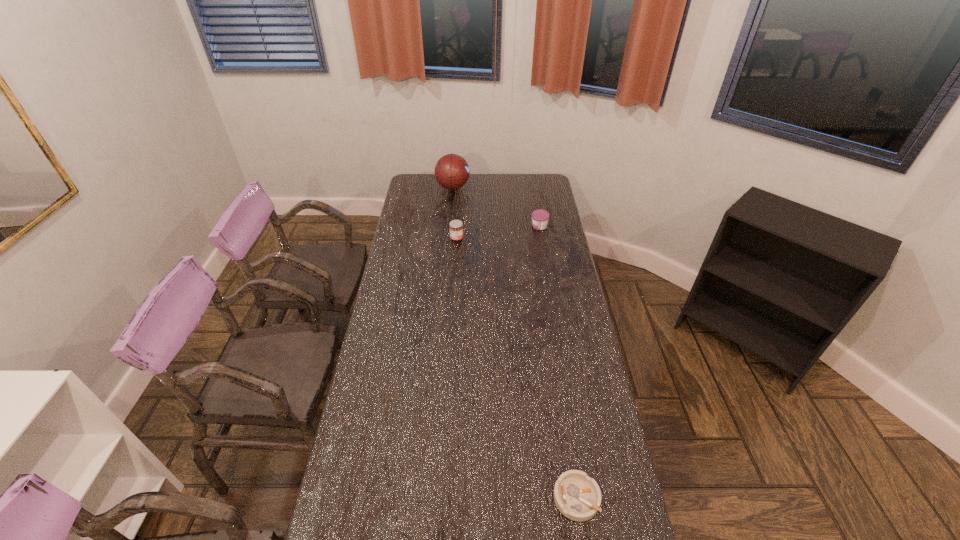
At what (x,y) coordinates should I click in order to perform the action: click on basketball. Please return your answer as a coordinate pair (x, y). Looking at the image, I should click on (452, 171).

The width and height of the screenshot is (960, 540). I want to click on the tallest object, so click(452, 171).

Identify the location of the left jam. (456, 226).

The height and width of the screenshot is (540, 960). In order to click on the third shortest object in this screenshot , I will do `click(456, 226)`.

At what (x,y) coordinates should I click in order to perform the action: click on the shorter jam. Please return your answer as a coordinate pair (x, y). The height and width of the screenshot is (540, 960). Looking at the image, I should click on (540, 217).

Identify the location of the farther jam. (540, 217).

Where is `ashtray`? The height and width of the screenshot is (540, 960). ashtray is located at coordinates tap(577, 496).

Locate an element on the screen. This screenshot has height=540, width=960. the nearest object is located at coordinates (577, 496).

I want to click on free location located on the left of the farthest object, so click(407, 187).

Locate an element on the screen. This screenshot has width=960, height=540. free space located 0.380m on the back of the third shortest object is located at coordinates coord(460,193).